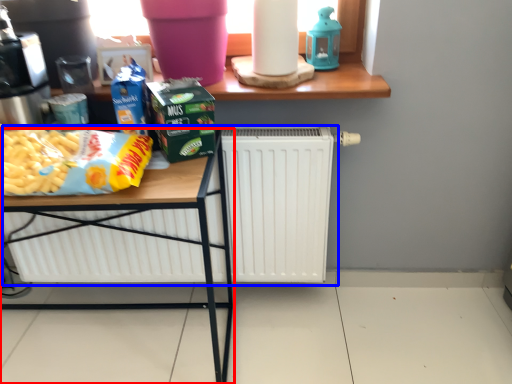
Question: Which point is closer to the camera, table (highlighted by a red box) or radiator (highlighted by a blue box)?

Choices:
 (A) table
 (B) radiator

Answer: (A)